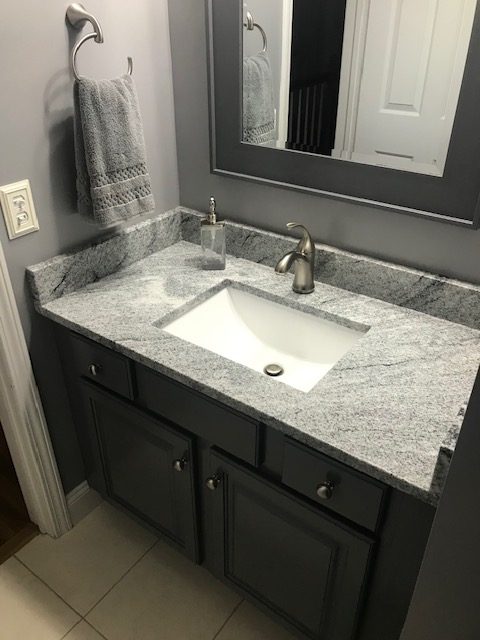
At what (x,y) coordinates should I click in order to perform the action: click on marble. Please return your answer as a coordinate pair (x, y). The width and height of the screenshot is (480, 640). Looking at the image, I should click on (380, 420).